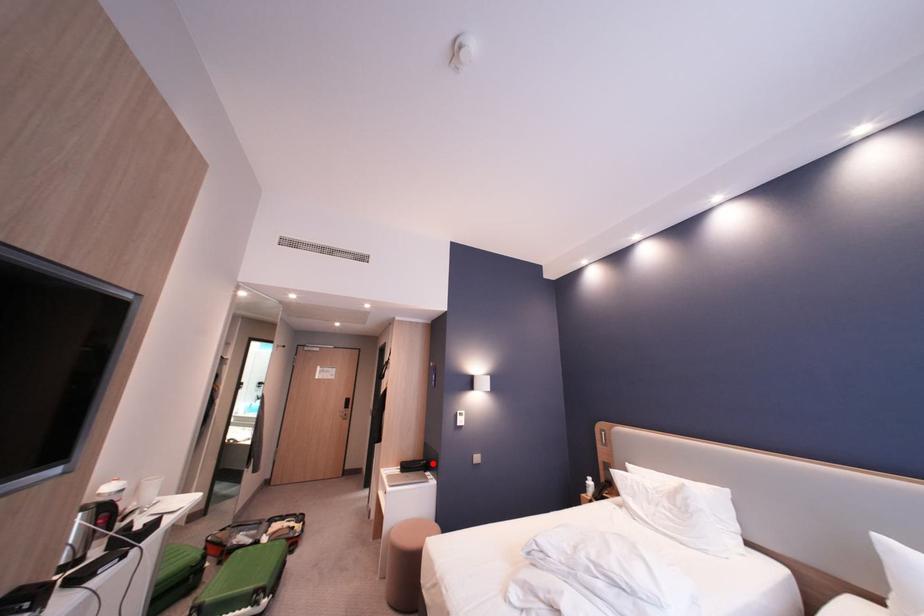
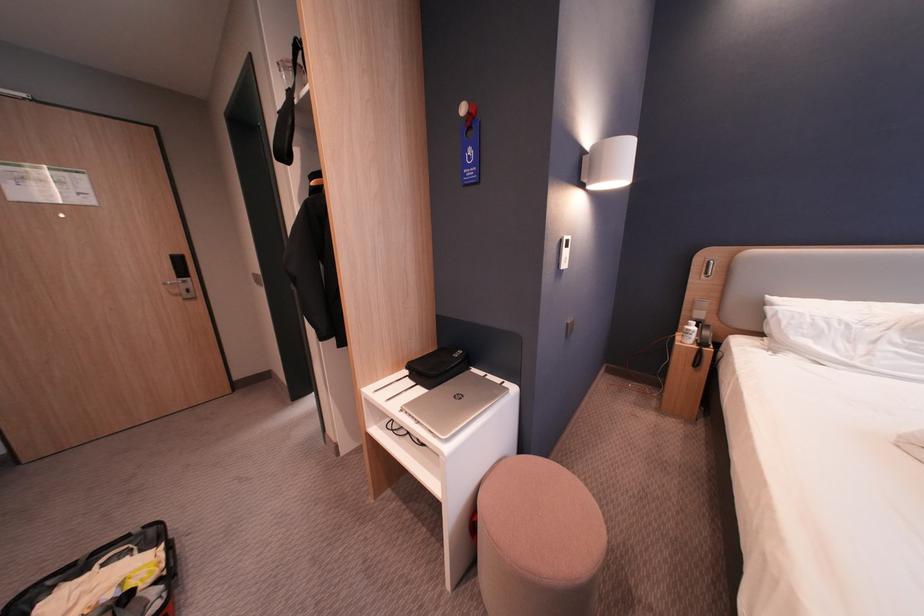
Where in the second image is the point corresponding to the highlighted location from the first image?

(467, 357)